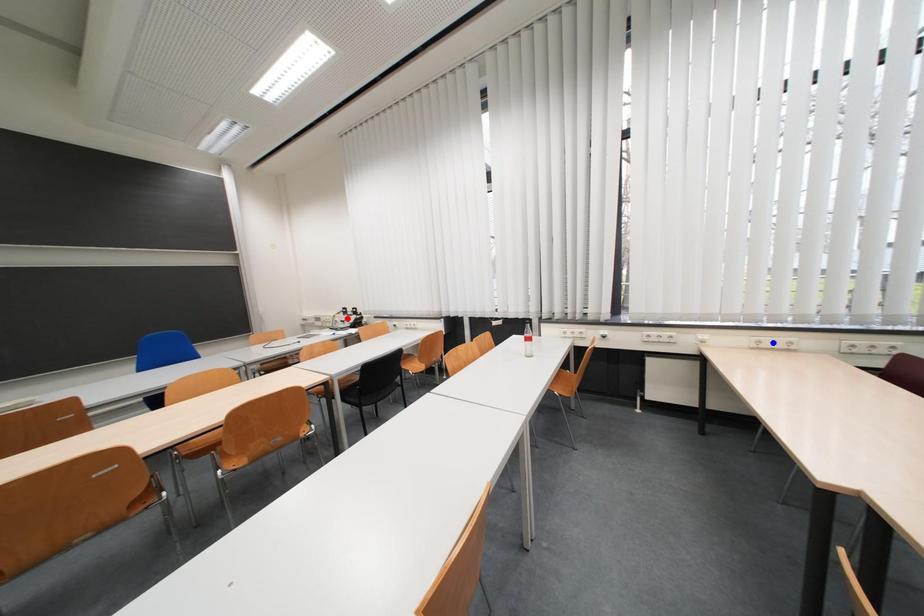
Question: Which of the two points in the image is closer to the camera?

Choices:
 (A) Blue point is closer.
 (B) Red point is closer.

Answer: (A)